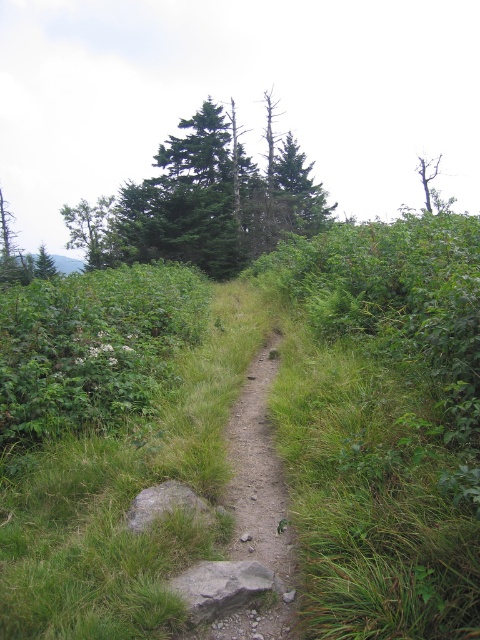
In the scene shown: You are planning to plant a new tree in this landscape. The green matte tree at upper center and the green leafy tree at upper right are already present. Which tree has a narrower width, and therefore might require less space when planting?

The green matte tree at upper center has a narrower width than the green leafy tree at upper right, so it requires less space when planting.